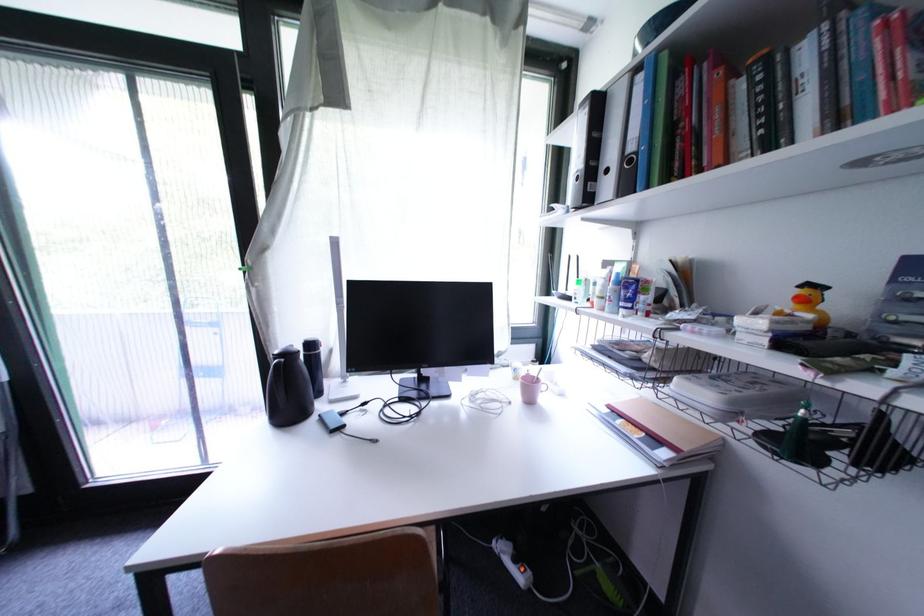
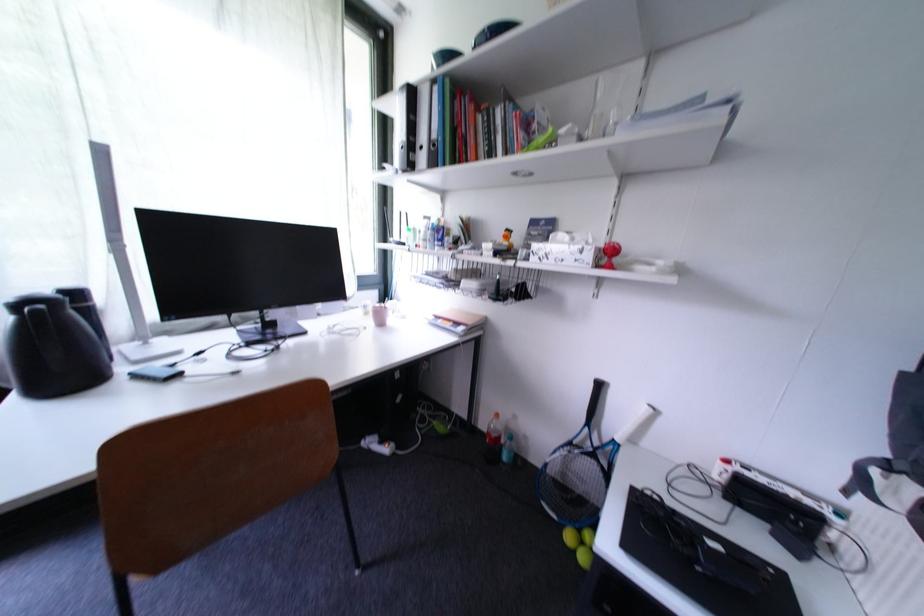
In the second image, find the point that corresponds to pixel 648 79 in the first image.

(444, 91)